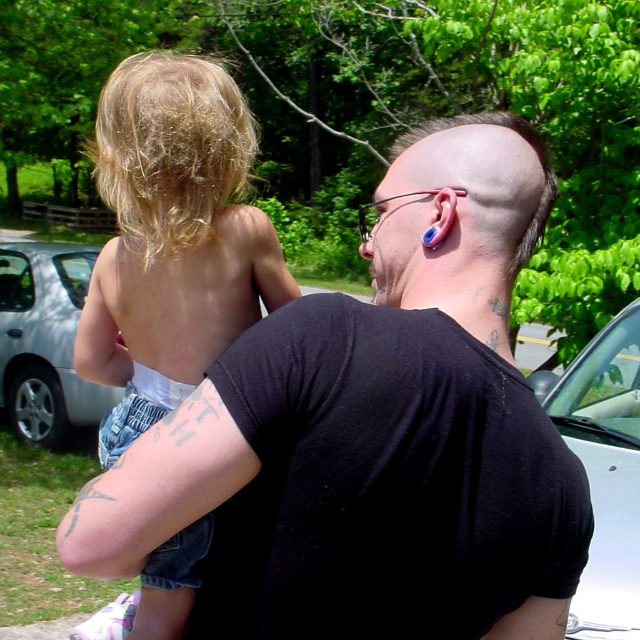
Question: Which of the following is the farthest from the observer?

Choices:
 (A) (445, 593)
 (B) (80, 285)
 (C) (198, 378)
 (D) (621, 522)

Answer: (B)

Question: Is black matte shirt at center smaller than blonde hair at upper left?

Choices:
 (A) no
 (B) yes

Answer: (B)

Question: Which object appears closest to the camera in this image?

Choices:
 (A) white glossy car at right
 (B) silver metallic car at left
 (C) black matte shirt at center

Answer: (C)

Question: Is black matte shirt at center closer to the viewer compared to white glossy car at right?

Choices:
 (A) yes
 (B) no

Answer: (A)

Question: Is black matte shirt at center to the left of silver metallic car at left from the viewer's perspective?

Choices:
 (A) yes
 (B) no

Answer: (B)

Question: Which of the following is the closest to the observer?

Choices:
 (A) (532, 376)
 (B) (468, 499)

Answer: (B)